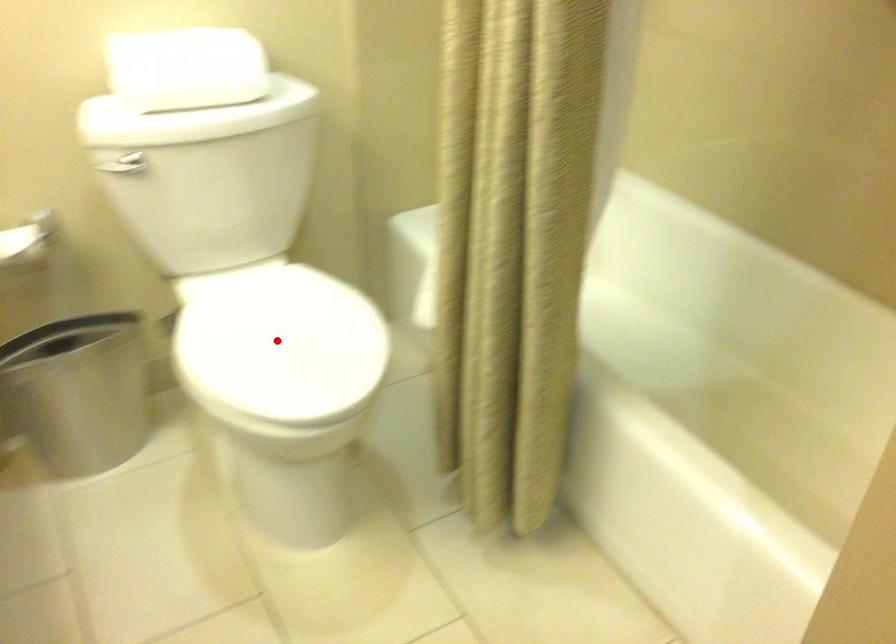
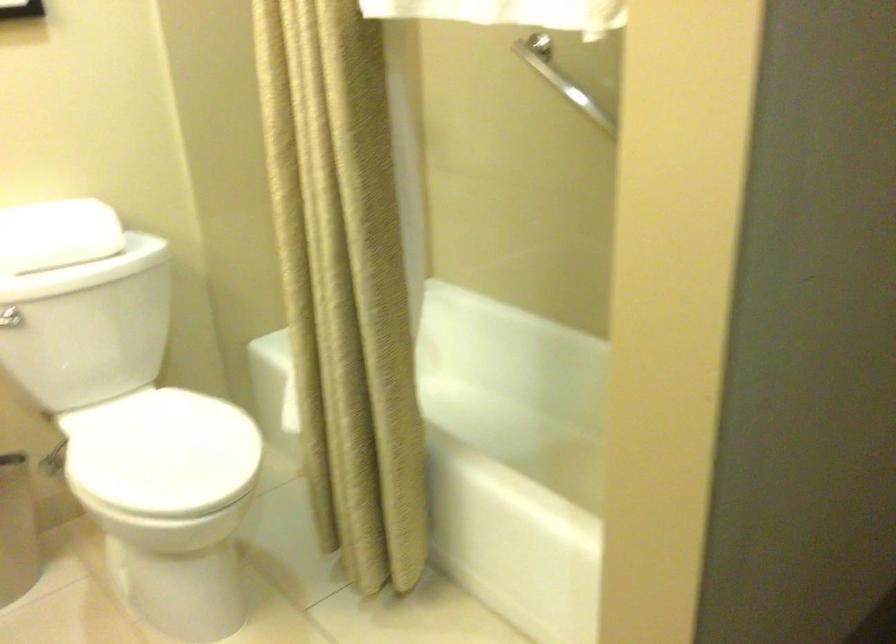
Where in the second image is the point corresponding to the highlighted location from the first image?

(161, 453)